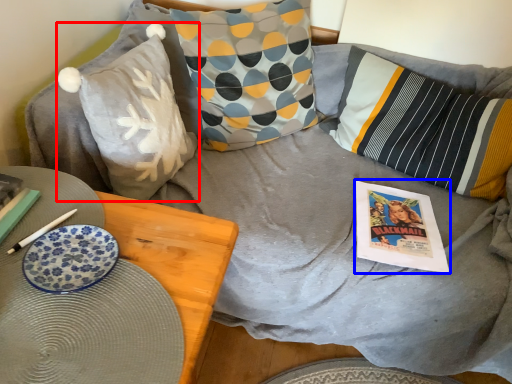
Question: Among these objects, which one is nearest to the camera, pillow (highlighted by a red box) or comic book (highlighted by a blue box)?

Choices:
 (A) pillow
 (B) comic book

Answer: (A)